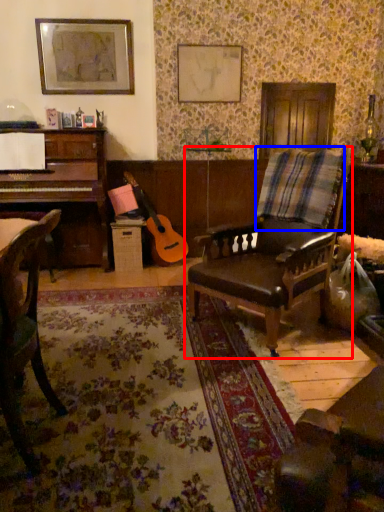
Question: Which point is further to the camera, chair (highlighted by a red box) or plaid (highlighted by a blue box)?

Choices:
 (A) chair
 (B) plaid

Answer: (B)